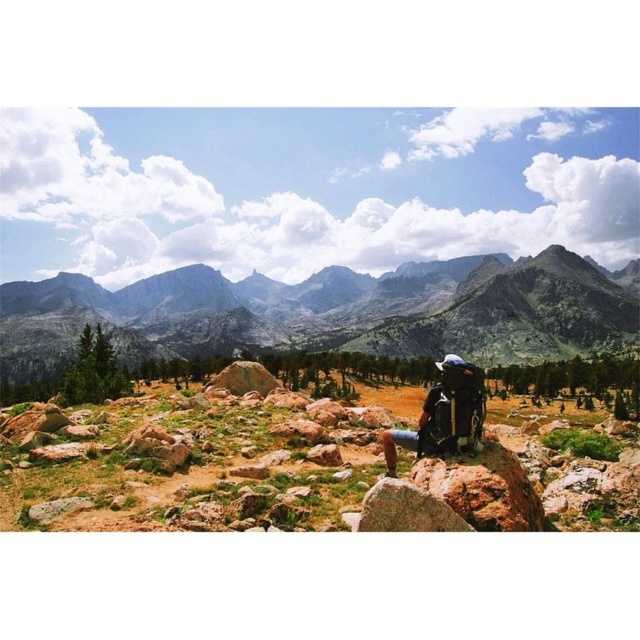
You are standing at the point with coordinates point (x=563, y=321) and want to move to the point (x=317, y=483). Which direction should you move relative to the scene?

You should move forward towards point (x=317, y=483) because it is in front of point (x=563, y=321).

Looking at this image, you are a hiker who wants to place your matte black backpack at center on the ground. Based on the scene, will the brown rocky terrain at center block the placement of the backpack?

The brown rocky terrain at center is in front of the matte black backpack at center, meaning the backpack is already placed on the rocky terrain. Therefore, the rocky terrain does not block the placement and the backpack is already positioned there.